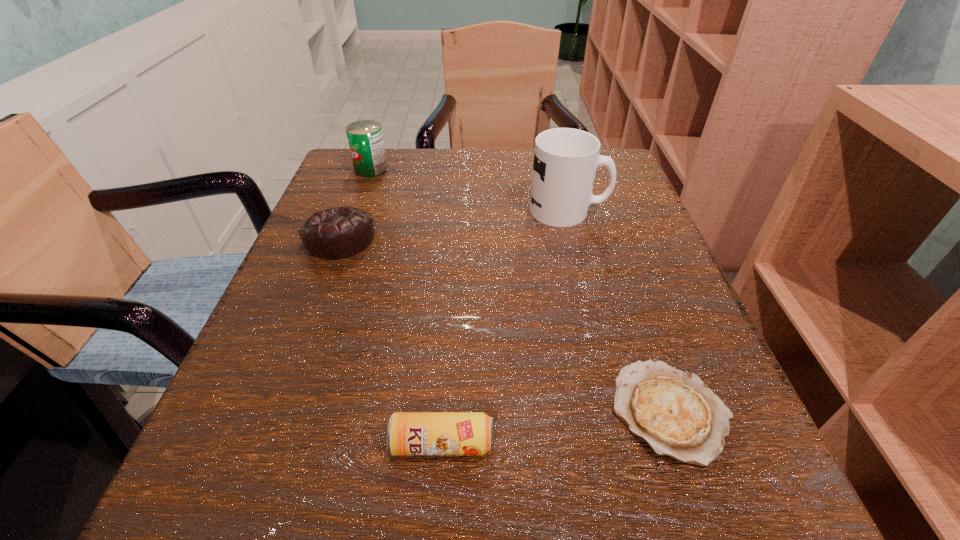
Locate an element on the screen. This screenshot has height=540, width=960. vacant region between the beanbag and the beer can is located at coordinates (391, 341).

Find the location of a particular element. The height and width of the screenshot is (540, 960). vacant area that lies between the quiche and the tallest object is located at coordinates (619, 311).

Identify the location of free point between the tallest object and the shortest object. The height and width of the screenshot is (540, 960). pos(619,311).

Identify the location of free space between the third object from left to right and the quiche. (556, 428).

I want to click on free space between the beer can and the shortest object, so click(556, 428).

At what (x,y) coordinates should I click in order to perform the action: click on vacant area that lies between the mug and the can. Please return your answer as a coordinate pair (x, y). Looking at the image, I should click on (469, 190).

I want to click on free space between the third object from right to left and the beanbag, so click(391, 341).

Where is `vacant area that lies between the mug and the farthest object`? vacant area that lies between the mug and the farthest object is located at coordinates [x=469, y=190].

This screenshot has height=540, width=960. Find the location of `vacant space in between the beanbag and the farthest object`. vacant space in between the beanbag and the farthest object is located at coordinates (355, 204).

This screenshot has height=540, width=960. Find the location of `free space between the second shortest object and the beanbag`. free space between the second shortest object and the beanbag is located at coordinates (391, 341).